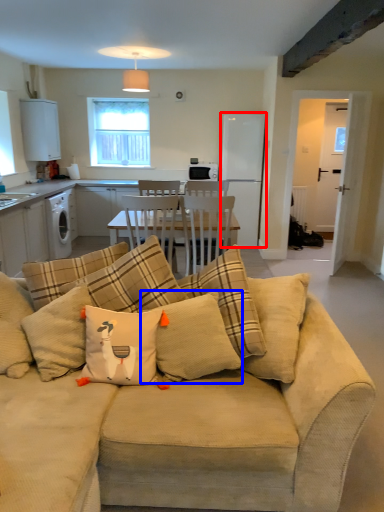
Question: Which object is further to the camera taking this photo, appliance (highlighted by a red box) or pillow (highlighted by a blue box)?

Choices:
 (A) appliance
 (B) pillow

Answer: (A)